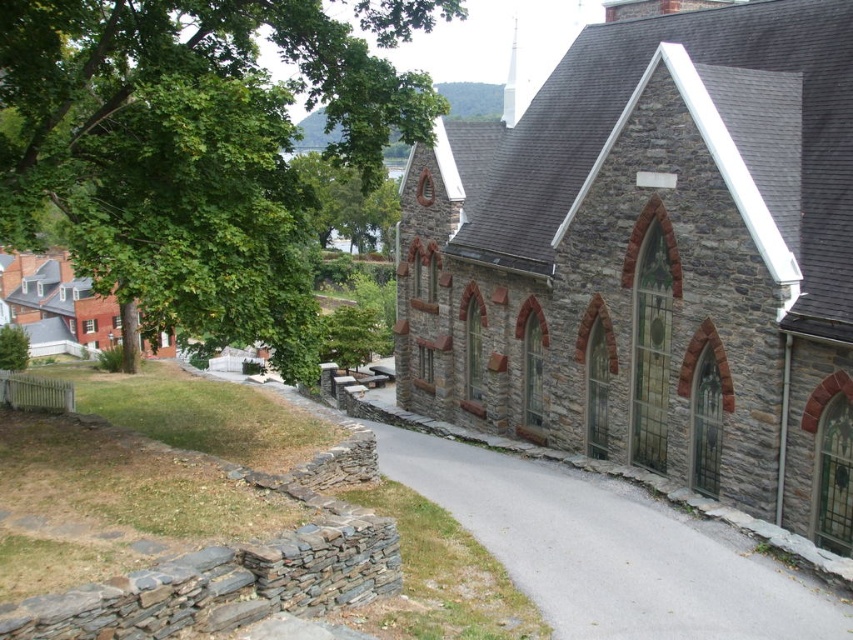
You are standing at the point labeled as point (653, 259) in the image. Based on the scene description, what structure are you directly in front of?

The point (653, 259) indicates the stone church at center, so you are directly in front of the stone church at center.

You are standing at the entrance of the historic stone church and want to take a photo of a specific point in the scene. The point you need to capture is located at coordinates point (552,220). Considering your camera has a maximum focus range of 30 meters, will you be able to focus on that point clearly?

The distance of point (552,220) from camera is 32.20 meters, which exceeds the camera maximum focus range of 30 meters. So the camera cannot focus on that point clearly.

You are standing at the entrance of the stone church at center and want to take a photo of the green leafy tree at upper left. Which object should appear narrower in the photo?

The stone church at center will appear narrower in the photo because it is thinner than the green leafy tree at upper left.